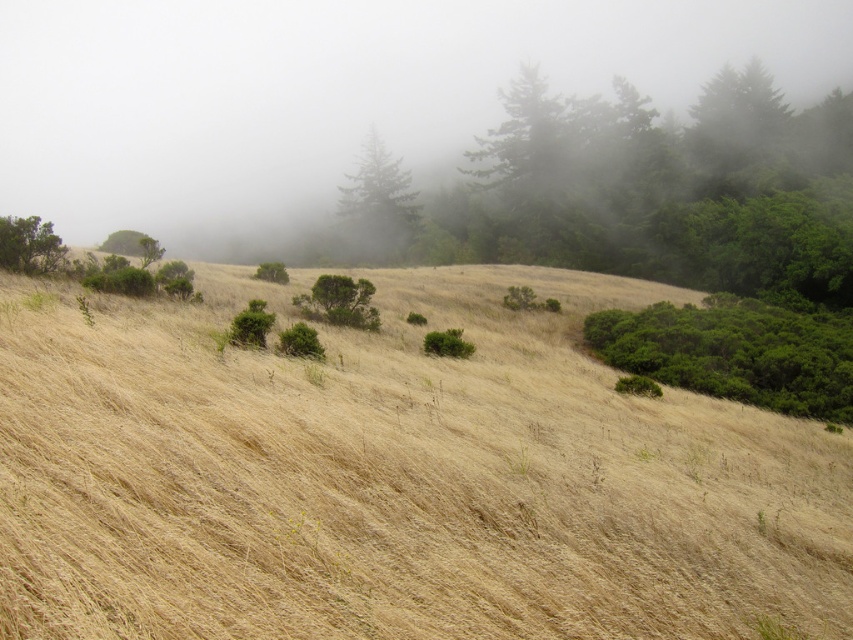
Does green leafy bush at center appear over green leafy tree at upper left?

No.

Does green leafy bush at center appear on the right side of green leafy tree at upper left?

Yes, green leafy bush at center is to the right of green leafy tree at upper left.

Between point (277, 273) and point (149, 237), which one is positioned in front?

Point (149, 237) is more forward.

Identify the location of green leafy bush at center. This screenshot has height=640, width=853. (271, 273).

Can you confirm if green matte bush at upper left is positioned above green leafy tree at upper left?

No.

Is green matte bush at upper left thinner than green leafy tree at upper left?

Yes.

Where is `green matte bush at upper left`? green matte bush at upper left is located at coordinates (28, 244).

Does green matte bush at upper left have a greater height compared to green leafy bush at center?

In fact, green matte bush at upper left may be shorter than green leafy bush at center.

Which is more to the left, green matte bush at upper left or green leafy bush at center?

green matte bush at upper left is more to the left.

Identify the location of green matte bush at upper left. The image size is (853, 640). (28, 244).

Where is `green matte bush at upper left`? green matte bush at upper left is located at coordinates (28, 244).